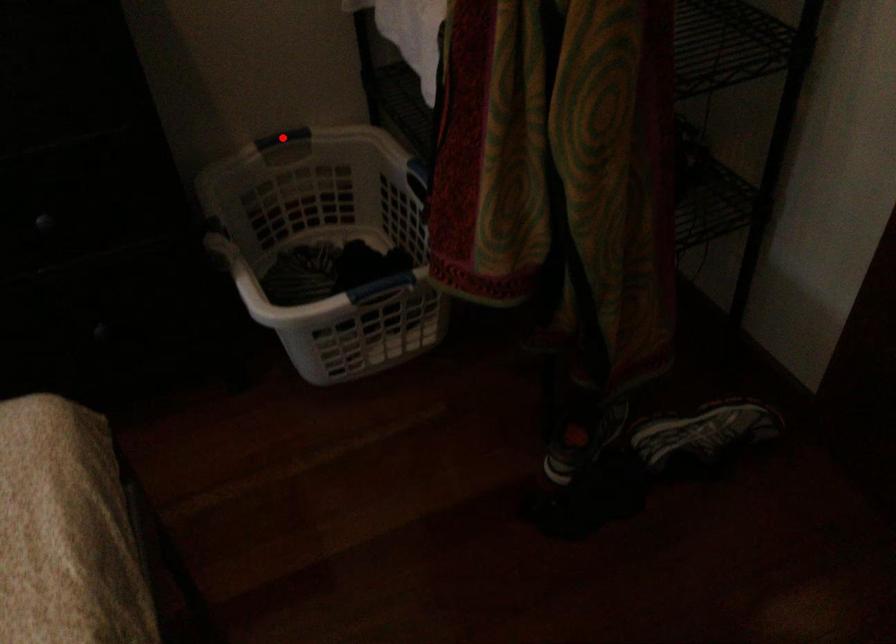
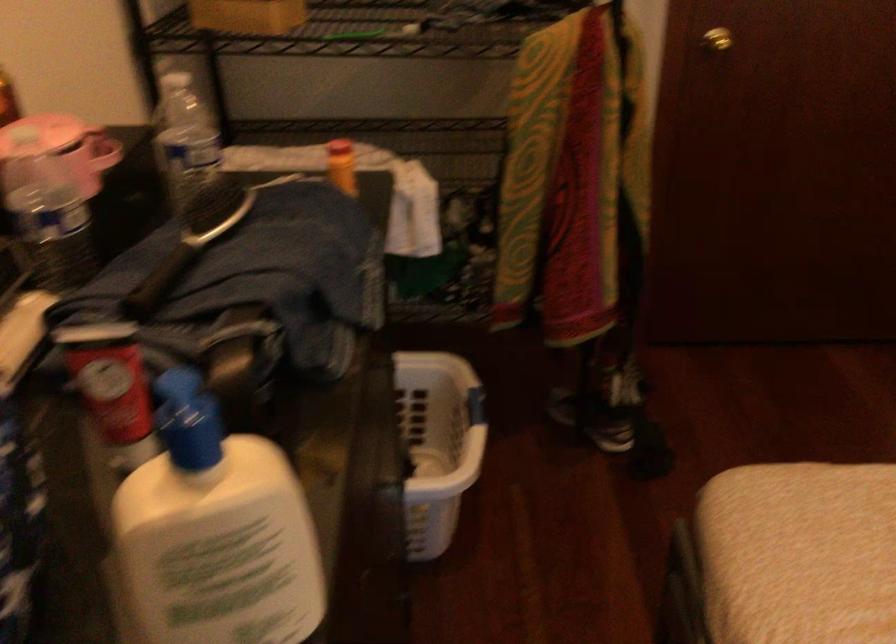
Question: I am providing you with two images of the same scene from different viewpoints. A red point is marked on the first image. At the location where the point appears in image 1, is it still visible in image 2?

Choices:
 (A) Yes
 (B) No

Answer: (B)